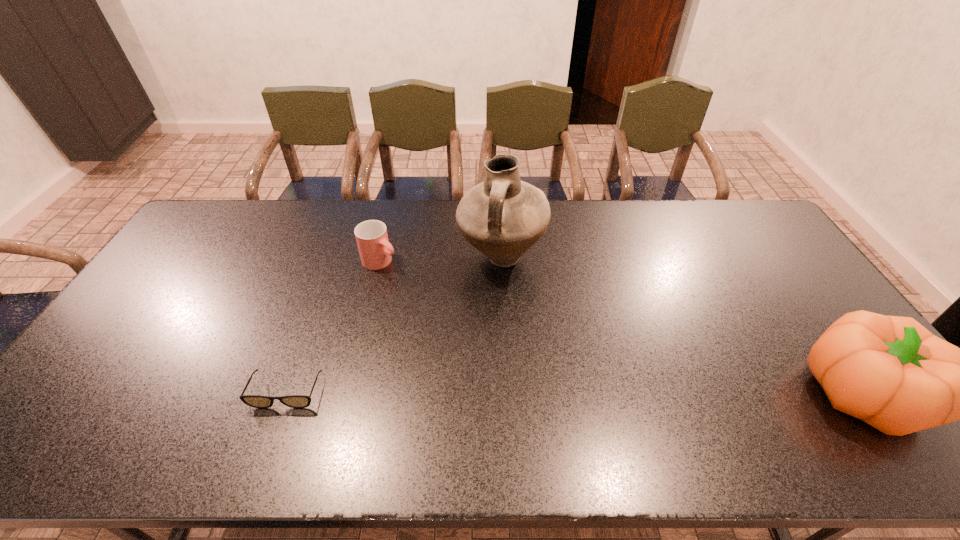
The image size is (960, 540). I want to click on vacant spot on the desktop that is between the leftmost object and the third shortest object and is positioned on the side of the second shortest object with the handle, so click(588, 392).

The height and width of the screenshot is (540, 960). What are the coordinates of `vacant space on the desktop that is between the leftmost object and the pumpkin and is positioned on the handle side of the tallest object` in the screenshot? It's located at (523, 392).